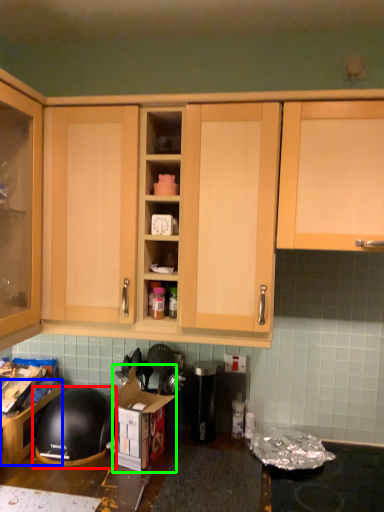
Question: Estimate the real-world distances between objects in this image. Which object is farther from helmet (highlighted by a red box), cabinetry (highlighted by a blue box) or cardboard box (highlighted by a green box)?

Choices:
 (A) cabinetry
 (B) cardboard box

Answer: (B)